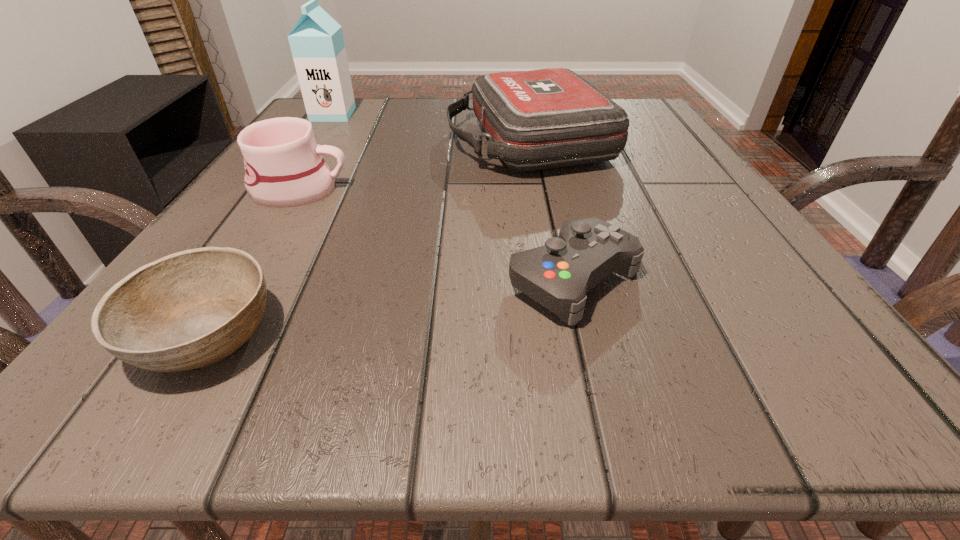
What are the coordinates of `the tallest object` in the screenshot? It's located at (316, 41).

Identify the location of the first-aid kit. (547, 118).

Identify the location of mug. The width and height of the screenshot is (960, 540). (284, 167).

You are a GUI agent. You are given a task and a screenshot of the screen. Output one action in this format:
    pyautogui.click(x=<x>, y=<y>)
    Task: Click on the control
    
    Given the screenshot: What is the action you would take?
    pyautogui.click(x=558, y=275)

Identify the location of bowl. (191, 309).

I want to click on vacant region located on the front of the tallest object, so click(x=309, y=151).

Identify the location of free spot located 0.240m on the front of the first-aid kit. The width and height of the screenshot is (960, 540). (555, 275).

Where is `vacant space located 0.050m on the side with the handle of the mug`? This screenshot has width=960, height=540. vacant space located 0.050m on the side with the handle of the mug is located at coordinates (379, 189).

Find the location of a particular element. Image resolution: width=960 pixels, height=540 pixels. vacant space located 0.320m on the left of the control is located at coordinates (252, 280).

Where is `free spot located on the right of the bowl`? This screenshot has height=540, width=960. free spot located on the right of the bowl is located at coordinates (604, 334).